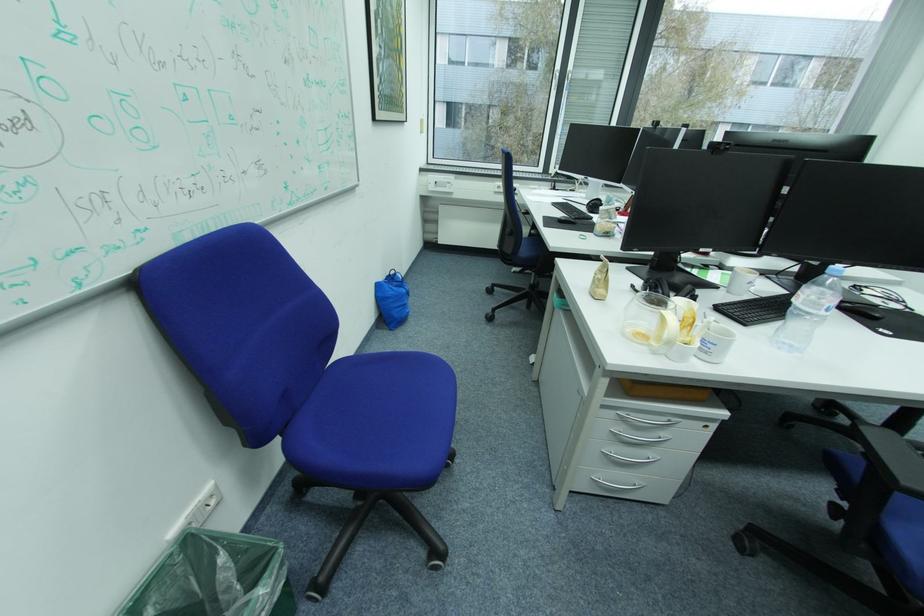
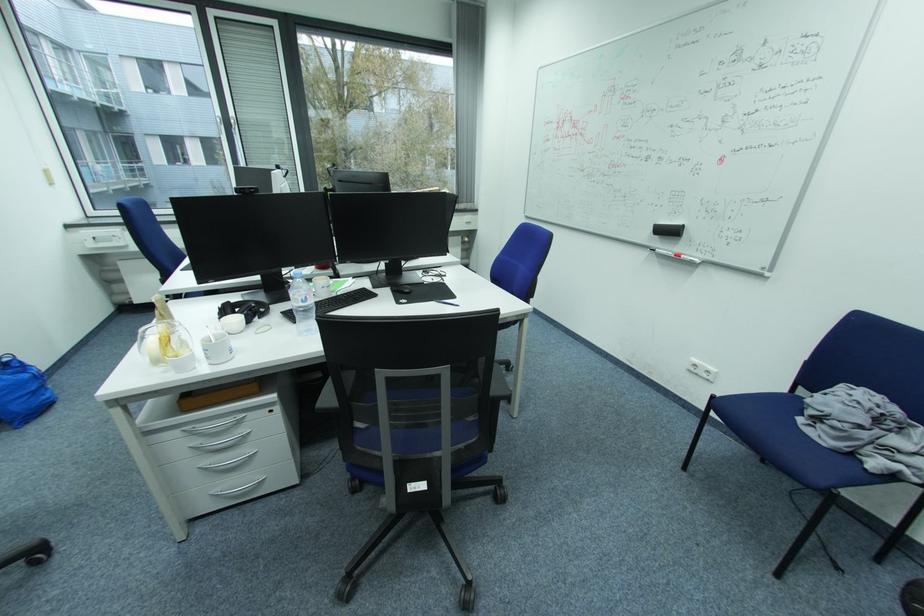
Where in the second image is the point corresponding to the point at 612,482 from the first image?

(229, 493)